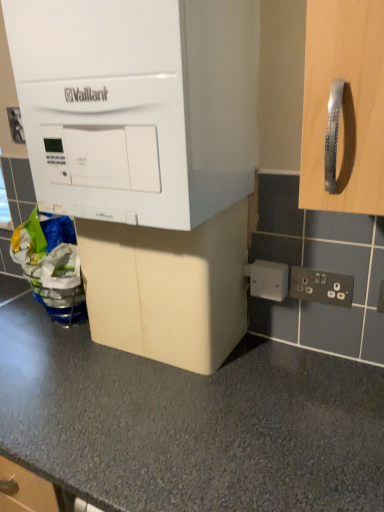
Question: Looking at the image, does white matte vaillant boiler at upper left, arranged as the first cabinetry when viewed from the top, seem bigger or smaller compared to beige matte cabinet at center, which appears as the 2th cabinetry when viewed from the top?

Choices:
 (A) big
 (B) small

Answer: (A)

Question: From the image's perspective, is white matte vaillant boiler at upper left, arranged as the first cabinetry when viewed from the top, located above or below beige matte cabinet at center, acting as the 1th cabinetry starting from the bottom?

Choices:
 (A) above
 (B) below

Answer: (A)

Question: Which object is the closest to the white plastic electric outlet at upper left, the 3th electric outlet when ordered from bottom to top?

Choices:
 (A) white plastic electric outlet at lower right, the second electric outlet from the top
 (B) white matte vaillant boiler at upper left, arranged as the first cabinetry when viewed from the top
 (C) black plastic electrical outlet at lower right, acting as the 3th electric outlet starting from the back
 (D) beige matte cabinet at center, acting as the 1th cabinetry starting from the bottom

Answer: (B)

Question: Estimate the real-world distances between objects in this image. Which object is closer to the black plastic electrical outlet at lower right, marked as the 1th electric outlet in a right-to-left arrangement?

Choices:
 (A) white plastic electric outlet at lower right, the 2th electric outlet when ordered from bottom to top
 (B) beige matte cabinet at center, acting as the 1th cabinetry starting from the bottom
 (C) white matte vaillant boiler at upper left, the second cabinetry when ordered from bottom to top
 (D) white plastic electric outlet at upper left, which appears as the 1th electric outlet when viewed from the back

Answer: (A)